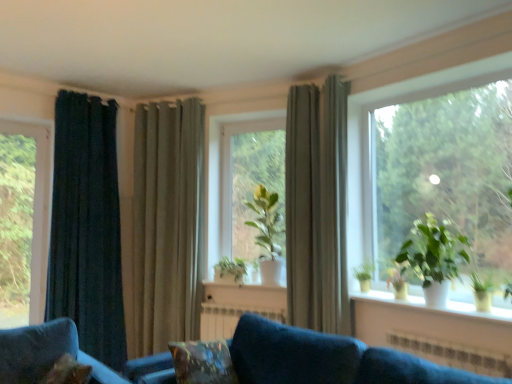
Question: From the image's perspective, is transparent glass window at left, the 2th window viewed from the front, above or below green matte plant at center, marked as the first houseplant in a left-to-right arrangement?

Choices:
 (A) below
 (B) above

Answer: (B)

Question: Considering the relative positions of transparent glass window at left, the second window in the right-to-left sequence, and green matte plant at center, which appears as the 3th houseplant when viewed from the front, in the image provided, is transparent glass window at left, the second window in the right-to-left sequence, to the left or to the right of green matte plant at center, which appears as the 3th houseplant when viewed from the front,?

Choices:
 (A) right
 (B) left

Answer: (B)

Question: Based on their relative distances, which object is farther from the green matte plant at right, which is counted as the 3th houseplant, starting from the left?

Choices:
 (A) transparent glass window at left, the 2th window viewed from the front
 (B) green matte plant at center, the second houseplant in the right-to-left sequence
 (C) dark green velvet curtain at left, the 3th curtain in the right-to-left sequence
 (D) velvety brown pillow at lower center
 (E) satin beige curtain at center, positioned as the first curtain in right-to-left order

Answer: (A)

Question: Which object is positioned farthest from the velvet blue couch at lower center?

Choices:
 (A) velvety brown pillow at lower center
 (B) green matte plant at center, positioned as the third houseplant in right-to-left order
 (C) green matte plant at center
 (D) dark green velvet curtain at left, acting as the 1th curtain starting from the left
 (E) satin beige curtain at center, which is counted as the third curtain, starting from the left

Answer: (D)